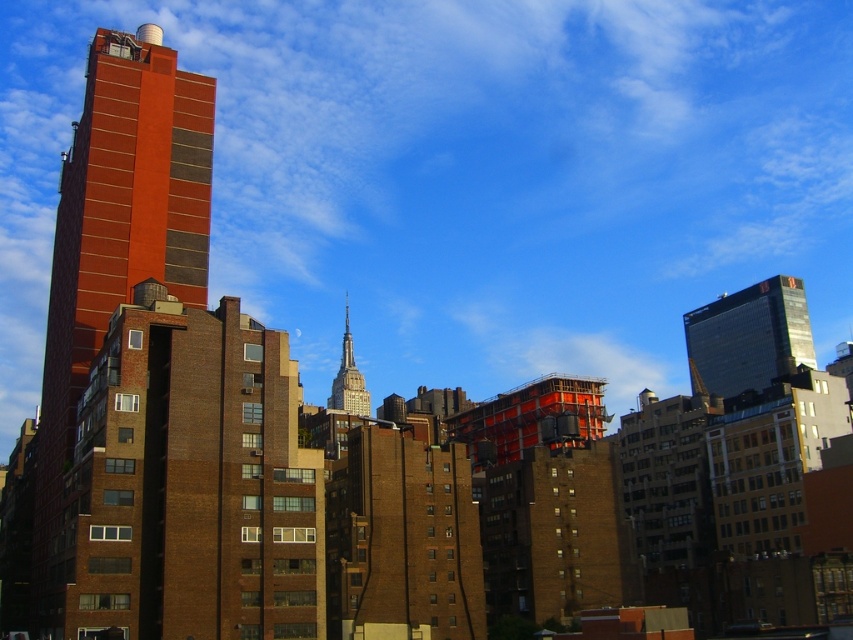
You are an urban planner evaluating the cityscape. You notice the brick building at left and the shiny glass skyscraper at upper right. Which structure is taller?

The brick building at left is taller than the shiny glass skyscraper at upper right according to the description.

Looking at this image, you are standing in the city square and want to take a photo of the shiny glass skyscraper at upper right. If your camera can focus on objects up to 100 meters away, will you be able to capture a clear image of it?

The shiny glass skyscraper at upper right is 93.75 meters from viewer, which is within the camera focus range of up to 100 meters. Therefore, you can capture a clear image of it.

You are an architect reviewing the city layout. You notice the shiny glass skyscraper at upper right and the white glass spire at center. Which of these two structures is positioned more to the east?

The shiny glass skyscraper at upper right is positioned more to the east because it is to the right of the white glass spire at center, and in the image, right corresponds to east.